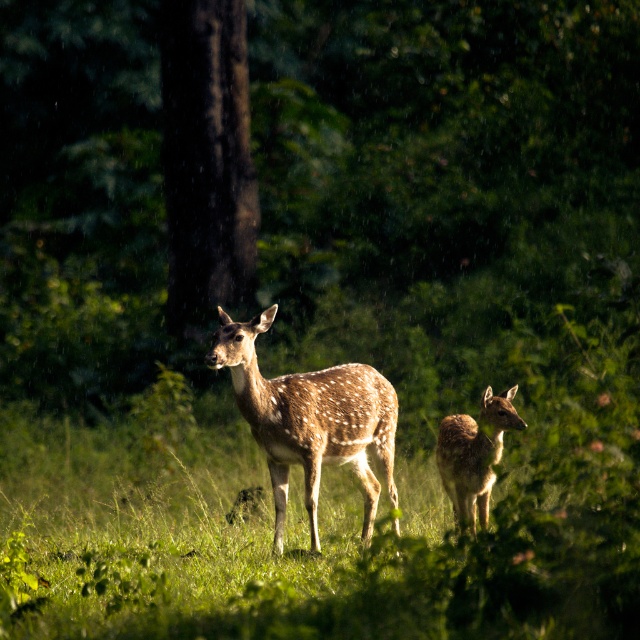
From the picture: You are standing in the meadow and want to reach a specific point marked at coordinates point (282, 396). If your maximum comfortable walking distance is 25 feet, can you comfortably walk to that point without needing to rest?

The distance of point (282, 396) from viewer is 30.13 feet, which exceeds your maximum comfortable walking distance of 25 feet. You may need to rest during the journey.

You are a wildlife photographer trying to capture both the spotted fur deer at center and the spotted fur deer at right in a single frame. Given that your camera has a fixed focal length, which deer should you focus on to ensure both are in the frame without moving the camera?

You should focus on the spotted fur deer at center because it is wider and positioned closer to the center, allowing the smaller spotted fur deer at right to fit within the frame as well.